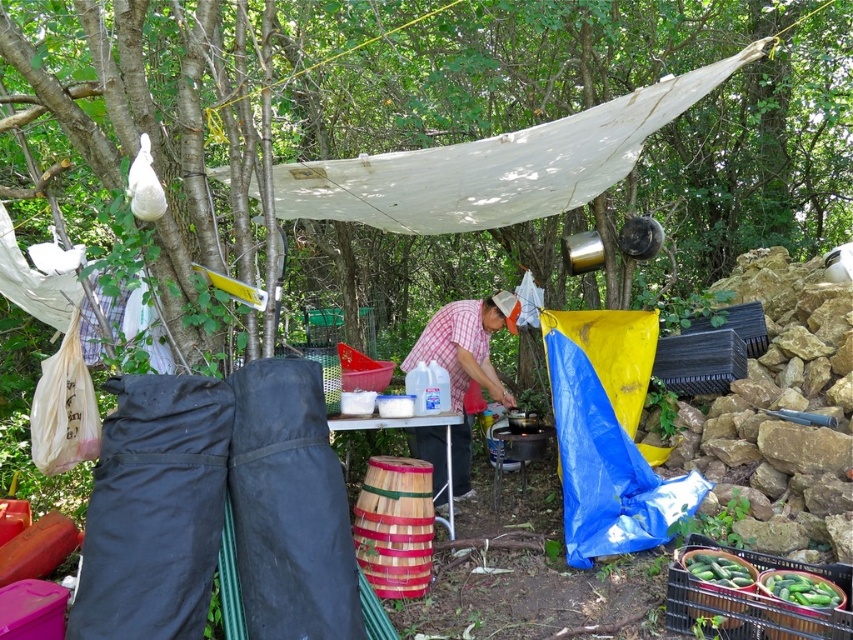
You are setting up a picnic table and need to place some cucumbers. The cucumbers are green matte cucumbers at lower right. Where should you place them relative to the white plastic picnic table at center?

The green matte cucumbers at lower right should be placed below the white plastic picnic table at center since the table is located above them.

You are setting up a picnic and want to place the green matte cucumber at lower right on the white plastic picnic table at center. Considering their sizes, will the cucumber fit on the table?

The green matte cucumber at lower right has a lesser width compared to the white plastic picnic table at center, so the cucumber will fit on the table since it is narrower.

You are organizing items on the table in the wooded area. You have a plaid shirt at center and green matte cucumbers at lower right. Which item is taller?

The plaid shirt at center is much taller than the green matte cucumbers at lower right.